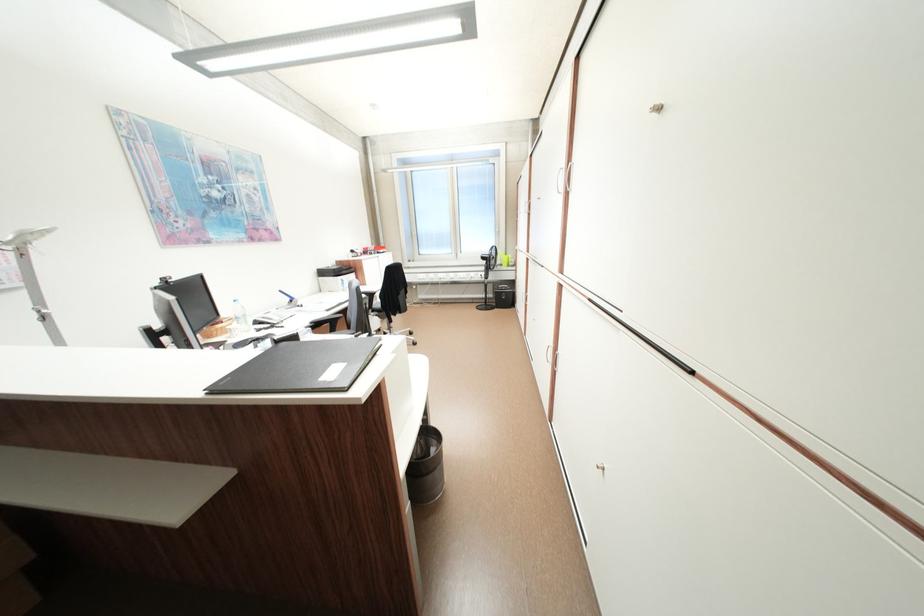
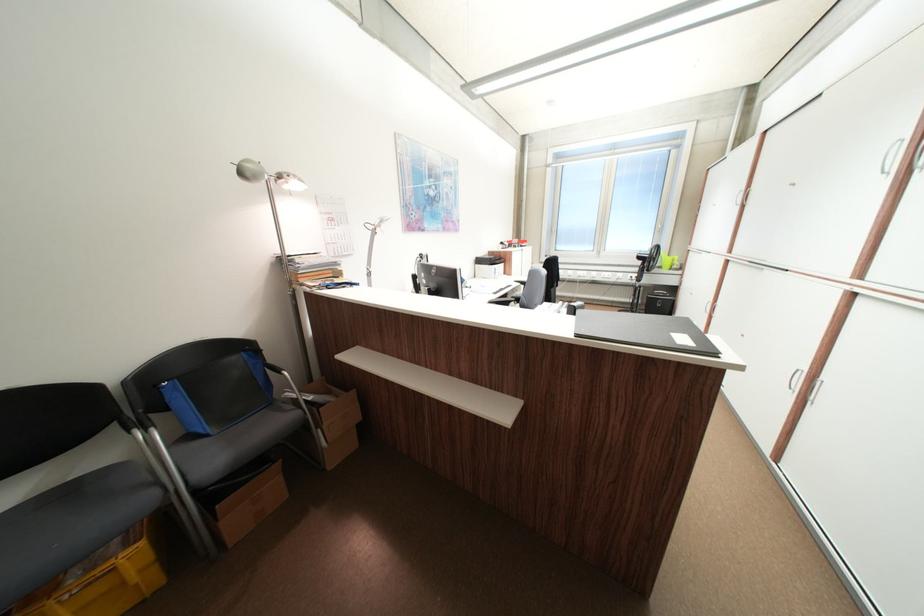
Question: The camera is either moving clockwise (left) or counter-clockwise (right) around the object. The first image is from the beginning of the video and the second image is from the end. Is the camera moving left or right when shooting the video?

Choices:
 (A) Left
 (B) Right

Answer: (B)